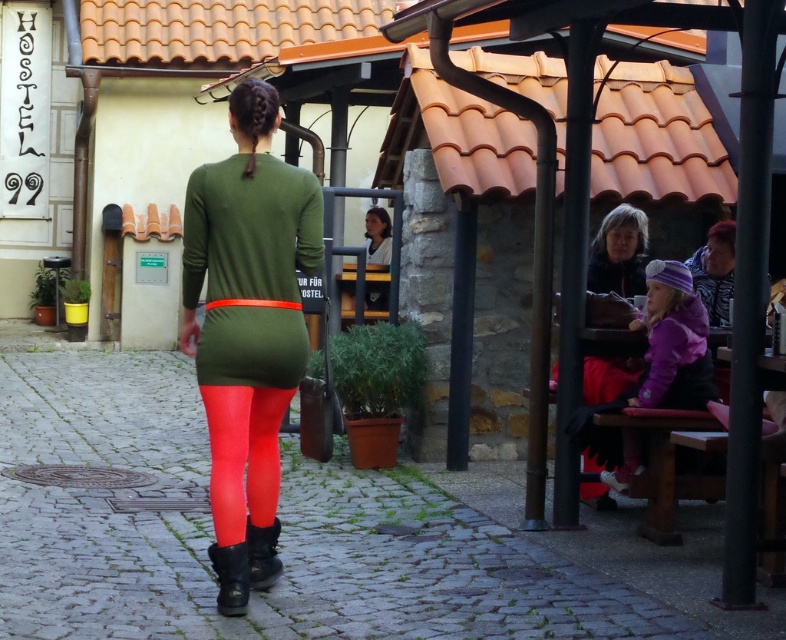
Question: From the image, what is the correct spatial relationship of purple fleece jacket at lower right in relation to leather boot at lower center?

Choices:
 (A) right
 (B) left

Answer: (A)

Question: Estimate the real-world distances between objects in this image. Which object is closer to the purple fleece jacket at lower right?

Choices:
 (A) neon matte leggings at lower center
 (B) leather boot at lower center

Answer: (A)

Question: Which of the following is the closest to the observer?

Choices:
 (A) leather boot at center
 (B) neon matte leggings at lower center
 (C) leather boot at lower center
 (D) matte green dress at center

Answer: (D)

Question: Which object appears farthest from the camera in this image?

Choices:
 (A) leather boot at center
 (B) matte black jacket at upper right

Answer: (B)

Question: Is neon matte leggings at lower center positioned in front of purple fleece jacket at lower right?

Choices:
 (A) yes
 (B) no

Answer: (A)

Question: Can you confirm if matte black jacket at upper right is smaller than leather boot at lower center?

Choices:
 (A) no
 (B) yes

Answer: (A)